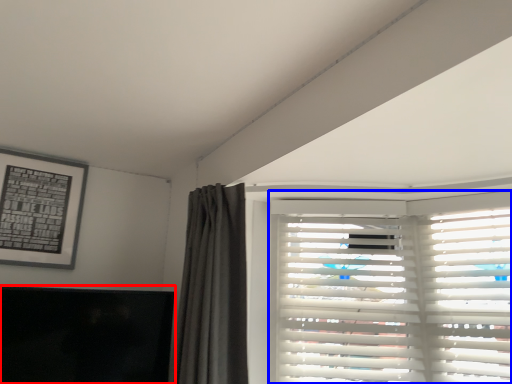
Question: Which point is closer to the camera, window screen (highlighted by a red box) or window blind (highlighted by a blue box)?

Choices:
 (A) window screen
 (B) window blind

Answer: (A)